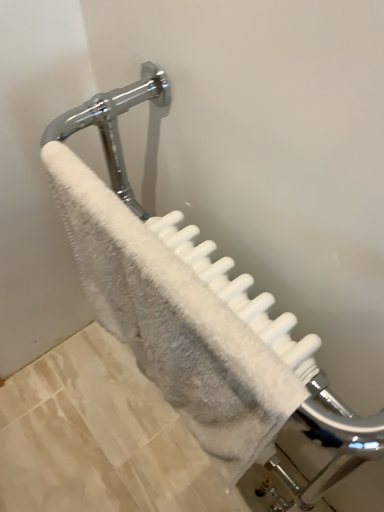
At what (x,y) coordinates should I click in order to perform the action: click on white fluffy towel at center. Please return your answer as a coordinate pair (x, y). The height and width of the screenshot is (512, 384). Looking at the image, I should click on (172, 321).

What do you see at coordinates (172, 321) in the screenshot? I see `white fluffy towel at center` at bounding box center [172, 321].

Image resolution: width=384 pixels, height=512 pixels. I want to click on white fluffy towel at center, so click(x=172, y=321).